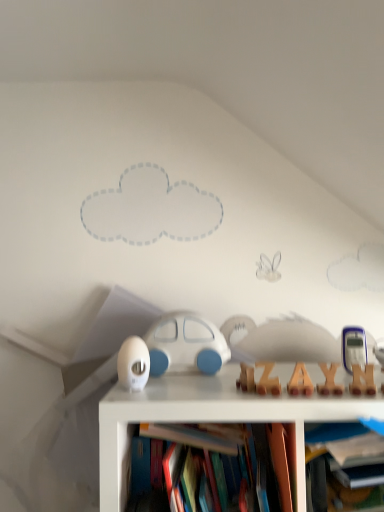
You are a GUI agent. You are given a task and a screenshot of the screen. Output one action in this format:
    pyautogui.click(x=<x>, y=<y>)
    Task: Click on the wooden letter at center, the third toy positioned from the left
    
    Given the screenshot: What is the action you would take?
    pyautogui.click(x=329, y=380)

From the image's perspective, which object appears higher, white matte car at center, which is the 3th toy from front to back, or wooden letter at center, which ranks as the 1th toy in right-to-left order?

white matte car at center, which is the 3th toy from front to back, from the image's perspective.

Who is shorter, white matte car at center, which is the 3th toy from front to back, or wooden letter at center, the 3th toy in the back-to-front sequence?

With less height is wooden letter at center, the 3th toy in the back-to-front sequence.

Starting from the wooden letter at center, which ranks as the 1th toy in right-to-left order, which toy is the 2nd one behind? Please provide its 2D coordinates.

[(185, 345)]

Between white matte car at center, which is the first toy in back-to-front order, and wooden letter at center, which ranks as the 1th toy in right-to-left order, which one is positioned in front?

Positioned in front is wooden letter at center, which ranks as the 1th toy in right-to-left order.

Considering the positions of objects white matte car at center, acting as the second toy starting from the right, and hardcover book at center in the image provided, who is in front, white matte car at center, acting as the second toy starting from the right, or hardcover book at center?

Positioned in front is hardcover book at center.

You are a GUI agent. You are given a task and a screenshot of the screen. Output one action in this format:
    pyautogui.click(x=<x>, y=<y>)
    Task: Click on the book below the white matte car at center, placed as the 2th toy when sorted from left to right (from a real-world perspective)
    
    Given the screenshot: What is the action you would take?
    pyautogui.click(x=280, y=463)

Is point (163, 319) closer or farther from the camera than point (282, 440)?

Point (163, 319).

Consider the image. What's the angular difference between white matte car at center, which is the first toy in back-to-front order, and hardcover book at center's facing directions?

white matte car at center, which is the first toy in back-to-front order, and hardcover book at center are facing 1.28 degrees away from each other.

Is wooden letter at center, the third toy positioned from the left, at the right side of hardcover book at center?

Indeed, wooden letter at center, the third toy positioned from the left, is positioned on the right side of hardcover book at center.

Can you confirm if wooden letter at center, the third toy positioned from the left, is thinner than hardcover book at center?

Indeed, wooden letter at center, the third toy positioned from the left, has a lesser width compared to hardcover book at center.

Who is smaller, wooden letter at center, the first toy from the front, or hardcover book at center?

wooden letter at center, the first toy from the front, is smaller.

Considering the sizes of objects wooden letter at center, the first toy from the front, and hardcover book at center in the image provided, who is taller, wooden letter at center, the first toy from the front, or hardcover book at center?

hardcover book at center is taller.

From a real-world perspective, which is physically below, hardcover book at center or white matte car at center, acting as the second toy starting from the right?

In real-world perspective, hardcover book at center is lower.

Which object is wider, hardcover book at center or white matte car at center, which is the 3th toy from front to back?

hardcover book at center.

Can you see hardcover book at center touching white matte car at center, which is the 3th toy from front to back?

No, hardcover book at center is not next to white matte car at center, which is the 3th toy from front to back.

This screenshot has width=384, height=512. I want to click on book on the right of white matte car at center, acting as the second toy starting from the right, so click(x=280, y=463).

From the image's perspective, who appears lower, white matte egg at center, the first toy viewed from the left, or hardcover book at center?

hardcover book at center, from the image's perspective.

At what (x,y) coordinates should I click in order to perform the action: click on book that is on the right side of white matte egg at center, the 2th toy from the back. Please return your answer as a coordinate pair (x, y). The height and width of the screenshot is (512, 384). Looking at the image, I should click on (280, 463).

Is white matte egg at center, the first toy viewed from the left, directly adjacent to hardcover book at center?

No, white matte egg at center, the first toy viewed from the left, is not with hardcover book at center.

Considering the relative sizes of white matte egg at center, the 2th toy from the back, and hardcover book at center in the image provided, is white matte egg at center, the 2th toy from the back, thinner than hardcover book at center?

Indeed, white matte egg at center, the 2th toy from the back, has a lesser width compared to hardcover book at center.

Locate an element on the screen. The height and width of the screenshot is (512, 384). book to the left of wooden letter at center, the third toy positioned from the left is located at coordinates (280, 463).

Which is less distant, (x=282, y=504) or (x=341, y=389)?

Point (x=282, y=504) is positioned closer to the camera compared to point (x=341, y=389).

Is hardcover book at center looking in the opposite direction of wooden letter at center, the first toy from the front?

No, hardcover book at center is not facing the opposite direction of wooden letter at center, the first toy from the front.

From a real-world perspective, is hardcover book at center on wooden letter at center, the 3th toy in the back-to-front sequence?

No, from a real-world perspective, hardcover book at center is not over wooden letter at center, the 3th toy in the back-to-front sequence

In the scene shown: Is hardcover book at center wider or thinner than white matte egg at center, the second toy from the front?

Clearly, hardcover book at center has more width compared to white matte egg at center, the second toy from the front.

From the picture: Which is correct: hardcover book at center is inside white matte egg at center, the 2th toy from the back, or outside of it?

hardcover book at center is located beyond the bounds of white matte egg at center, the 2th toy from the back.

From the picture: Would you consider hardcover book at center to be distant from white matte egg at center, the second toy from the front?

No, hardcover book at center is in close proximity to white matte egg at center, the second toy from the front.

Could you tell me if hardcover book at center is facing white matte egg at center, which is the third toy from right to left?

No, hardcover book at center does not turn towards white matte egg at center, which is the third toy from right to left.

This screenshot has height=512, width=384. I want to click on toy located on the right of white matte car at center, acting as the second toy starting from the right, so click(329, 380).

Where is `book in front of the white matte car at center, which is the first toy in back-to-front order`? The width and height of the screenshot is (384, 512). book in front of the white matte car at center, which is the first toy in back-to-front order is located at coordinates (280, 463).

Considering their positions, is white matte car at center, which is the 3th toy from front to back, positioned closer to wooden letter at center, the 3th toy in the back-to-front sequence, than white matte egg at center, the first toy viewed from the left?

Among the two, white matte car at center, which is the 3th toy from front to back, is located nearer to wooden letter at center, the 3th toy in the back-to-front sequence.

Estimate the real-world distances between objects in this image. Which object is further from white matte egg at center, which is the third toy from right to left, white matte car at center, which is the first toy in back-to-front order, or wooden letter at center, the 3th toy in the back-to-front sequence?

wooden letter at center, the 3th toy in the back-to-front sequence, is positioned further to the anchor white matte egg at center, which is the third toy from right to left.

Estimate the real-world distances between objects in this image. Which object is further from hardcover book at center, wooden letter at center, the first toy from the front, or white matte egg at center, the 2th toy from the back?

white matte egg at center, the 2th toy from the back, is further to hardcover book at center.

Based on their spatial positions, is hardcover book at center or white matte car at center, placed as the 2th toy when sorted from left to right, closer to white matte egg at center, the 2th toy from the back?

Among the two, white matte car at center, placed as the 2th toy when sorted from left to right, is located nearer to white matte egg at center, the 2th toy from the back.

Estimate the real-world distances between objects in this image. Which object is closer to white matte egg at center, which is the third toy from right to left, white matte car at center, which is the 3th toy from front to back, or hardcover book at center?

white matte car at center, which is the 3th toy from front to back, is positioned closer to the anchor white matte egg at center, which is the third toy from right to left.

Based on their spatial positions, is hardcover book at center or white matte egg at center, the second toy from the front, further from white matte car at center, acting as the second toy starting from the right?

Based on the image, hardcover book at center appears to be further to white matte car at center, acting as the second toy starting from the right.

Based on the photo, when comparing their distances from white matte car at center, which is the first toy in back-to-front order, does white matte egg at center, which is the third toy from right to left, or hardcover book at center seem further?

hardcover book at center lies further to white matte car at center, which is the first toy in back-to-front order, than the other object.

Based on their spatial positions, is wooden letter at center, the first toy from the front, or white matte car at center, acting as the second toy starting from the right, closer to white matte egg at center, which is the third toy from right to left?

white matte car at center, acting as the second toy starting from the right, is closer to white matte egg at center, which is the third toy from right to left.

The width and height of the screenshot is (384, 512). Identify the location of toy situated between white matte egg at center, the first toy viewed from the left, and hardcover book at center from left to right. (185, 345).

In order to click on toy between white matte egg at center, which is the third toy from right to left, and wooden letter at center, which ranks as the 1th toy in right-to-left order in this screenshot , I will do `click(185, 345)`.

You are a GUI agent. You are given a task and a screenshot of the screen. Output one action in this format:
    pyautogui.click(x=<x>, y=<y>)
    Task: Click on the book located between white matte egg at center, the second toy from the front, and wooden letter at center, the first toy from the front, in the left-right direction
    The height and width of the screenshot is (512, 384).
    Given the screenshot: What is the action you would take?
    pyautogui.click(x=280, y=463)